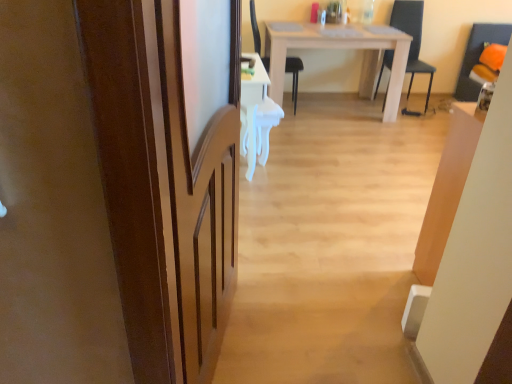
Question: Is black plastic chair at center, the first chair in the left-to-right sequence, to the right of white glossy desk at center from the viewer's perspective?

Choices:
 (A) no
 (B) yes

Answer: (B)

Question: Is black plastic chair at center, which is the 2th chair in right-to-left order, far away from white glossy desk at center?

Choices:
 (A) no
 (B) yes

Answer: (B)

Question: From a real-world perspective, is black plastic chair at center, which is the 2th chair in right-to-left order, positioned over white glossy desk at center based on gravity?

Choices:
 (A) yes
 (B) no

Answer: (A)

Question: Is black plastic chair at center, which is the 2th chair in right-to-left order, oriented away from white glossy desk at center?

Choices:
 (A) no
 (B) yes

Answer: (A)

Question: Is black plastic chair at center, which is the 2th chair in right-to-left order, bigger than white glossy desk at center?

Choices:
 (A) no
 (B) yes

Answer: (B)

Question: Does black plastic chair at center, the first chair in the left-to-right sequence, have a lesser width compared to white glossy desk at center?

Choices:
 (A) yes
 (B) no

Answer: (B)

Question: Considering the relative sizes of brown wooden screen door at left and white matte table at center in the image provided, is brown wooden screen door at left wider than white matte table at center?

Choices:
 (A) no
 (B) yes

Answer: (A)

Question: Does brown wooden screen door at left have a lesser width compared to white matte table at center?

Choices:
 (A) no
 (B) yes

Answer: (B)

Question: Considering the relative sizes of brown wooden screen door at left and white matte table at center in the image provided, is brown wooden screen door at left shorter than white matte table at center?

Choices:
 (A) no
 (B) yes

Answer: (A)

Question: Can you confirm if brown wooden screen door at left is positioned to the left of white matte table at center?

Choices:
 (A) yes
 (B) no

Answer: (A)

Question: Is brown wooden screen door at left outside white matte table at center?

Choices:
 (A) no
 (B) yes

Answer: (B)

Question: Can you confirm if brown wooden screen door at left is positioned to the right of white matte table at center?

Choices:
 (A) no
 (B) yes

Answer: (A)

Question: From a real-world perspective, is black plastic chair at center, the first chair in the left-to-right sequence, on brown wooden screen door at left?

Choices:
 (A) yes
 (B) no

Answer: (B)